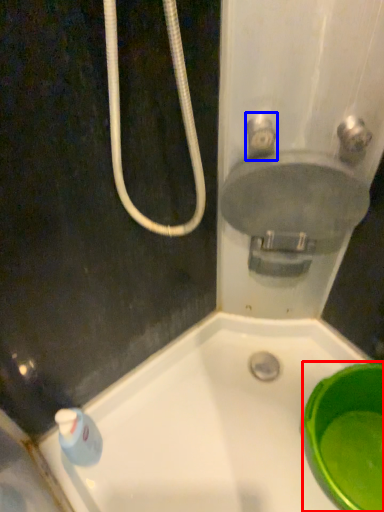
Question: Among these objects, which one is nearest to the camera, basin (highlighted by a red box) or plumbing fixture (highlighted by a blue box)?

Choices:
 (A) basin
 (B) plumbing fixture

Answer: (B)